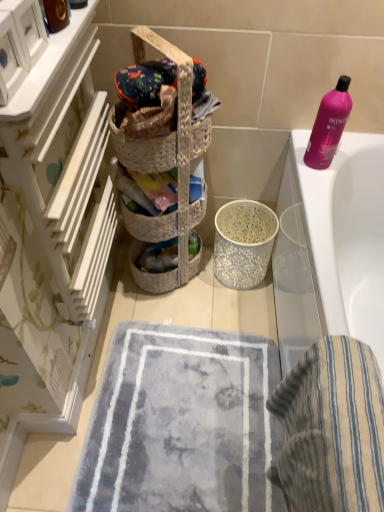
Question: Considering their positions, is white wood drawers at left located in front of or behind white glossy bathtub at upper right?

Choices:
 (A) behind
 (B) front

Answer: (B)

Question: Considering the positions of white wood drawers at left and white glossy bathtub at upper right in the image, is white wood drawers at left bigger or smaller than white glossy bathtub at upper right?

Choices:
 (A) big
 (B) small

Answer: (B)

Question: Which is nearer to the white wood drawers at left?

Choices:
 (A) soft gray carpet at center
 (B) blue striped towel at lower right
 (C) white glossy bathtub at upper right
 (D) pink plastic bottle at upper right
 (E) woven straw basket at center

Answer: (E)

Question: Considering the real-world distances, which object is closest to the white glossy bathtub at upper right?

Choices:
 (A) pink plastic bottle at upper right
 (B) soft gray carpet at center
 (C) white wood drawers at left
 (D) woven straw basket at center
 (E) blue striped towel at lower right

Answer: (A)